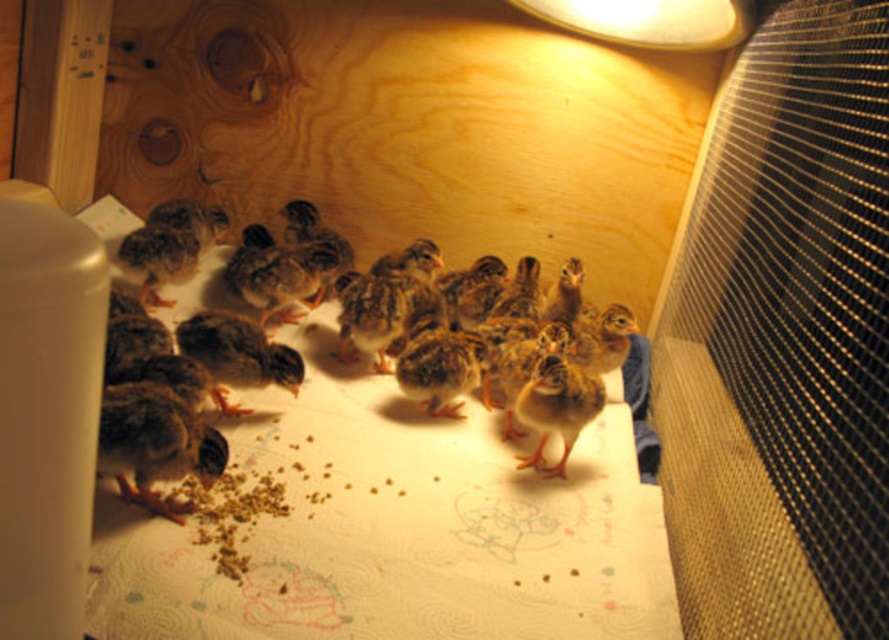
Question: Which of the following is the farthest from the observer?

Choices:
 (A) metallic silver lampshade at upper center
 (B) brown speckled chicks at center

Answer: (B)

Question: Can you confirm if brown speckled chicks at center is wider than metallic silver lampshade at upper center?

Choices:
 (A) no
 (B) yes

Answer: (B)

Question: Estimate the real-world distances between objects in this image. Which object is closer to the metallic silver lampshade at upper center?

Choices:
 (A) black mesh screen at right
 (B) brown speckled chicks at center

Answer: (A)

Question: Can you confirm if brown speckled chicks at center is positioned below metallic silver lampshade at upper center?

Choices:
 (A) yes
 (B) no

Answer: (A)

Question: From the image, what is the correct spatial relationship of black mesh screen at right in relation to metallic silver lampshade at upper center?

Choices:
 (A) above
 (B) below

Answer: (B)

Question: Which point is closer to the camera?

Choices:
 (A) brown speckled chicks at center
 (B) black mesh screen at right

Answer: (B)